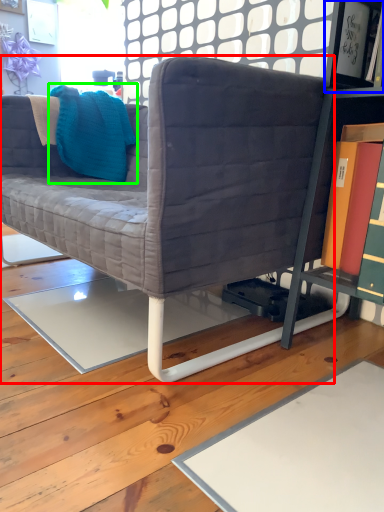
Question: Which object is the farthest from studio couch (highlighted by a red box)? Choose among these: shelf (highlighted by a blue box) or throw pillow (highlighted by a green box).

Choices:
 (A) shelf
 (B) throw pillow

Answer: (A)